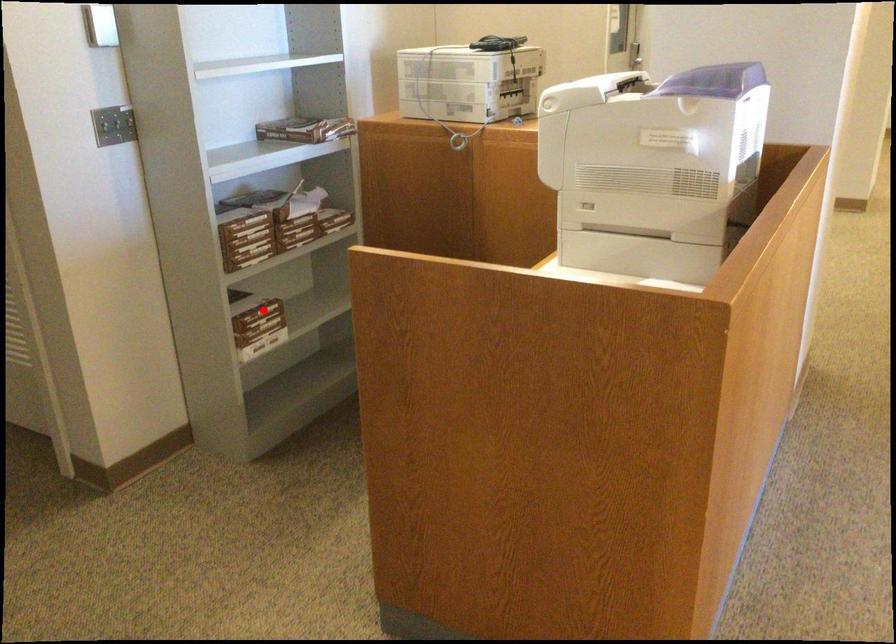
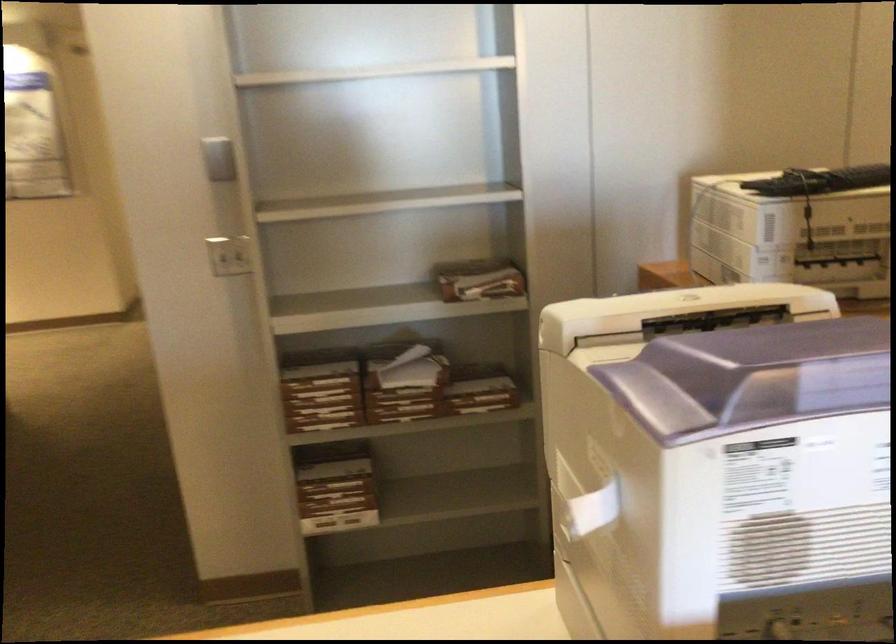
Question: A red point is marked in image1. In image2, is the corresponding 3D point closer to the camera or farther? Reply with the corresponding letter.

Choices:
 (A) The corresponding 3D point is closer.
 (B) The corresponding 3D point is farther.

Answer: (A)